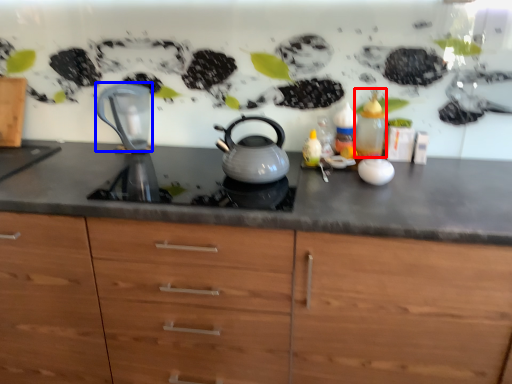
Question: Among these objects, which one is farthest to the camera, bottle (highlighted by a red box) or jug (highlighted by a blue box)?

Choices:
 (A) bottle
 (B) jug

Answer: (B)